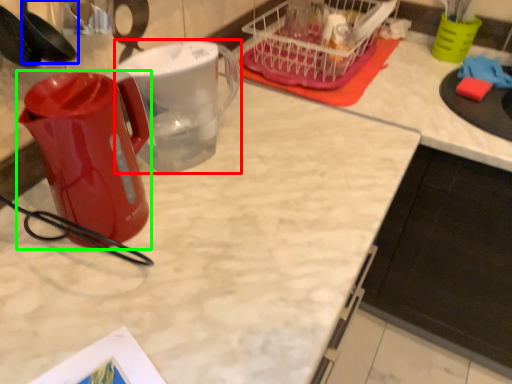
Question: Considering the real-world distances, which object is farthest from pitcher (highlighted by a red box)? spoon (highlighted by a blue box) or kettle (highlighted by a green box)?

Choices:
 (A) spoon
 (B) kettle

Answer: (A)